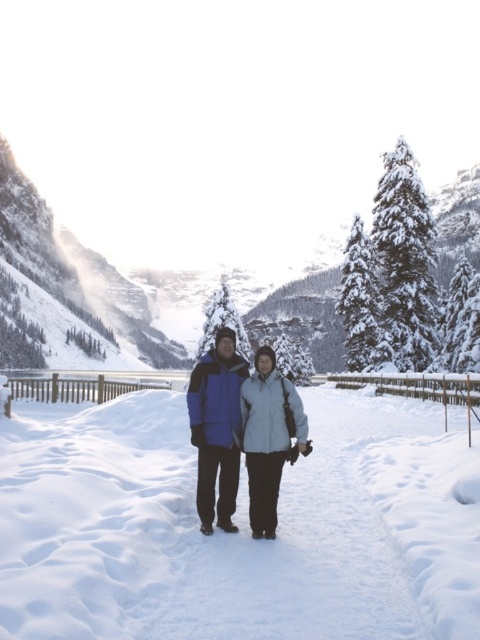
You are planning to take a photo of the blue synthetic jacket at center and the green matte pine at center in the winter scene. Given that the two objects are 44.46 meters apart, will you need to use a telephoto lens to ensure both are in focus and clear?

The blue synthetic jacket at center and the green matte pine at center are 44.46 meters apart. To capture both in focus and clear, a telephoto lens would be necessary due to the significant distance between them.

You are planning to take a photo of the blue synthetic jacket at center and the green matte pine at center in the winter scene. Which object should you focus on first if you want to capture both in a single frame without moving the camera?

You should focus on the green matte pine at center first because it occupies more space than the blue synthetic jacket at center, allowing it to be centered while still including the smaller jacket in the frame.

You are planning to take a photo of the snowy granite mountain at center and the light blue fabric jacket at center. Since you want both subjects to be clearly visible, which object should you focus on first to ensure proper depth of field?

→ The snowy granite mountain at center is taller than the light blue fabric jacket at center, so focusing on the mountain first will ensure both are in focus due to its greater height.